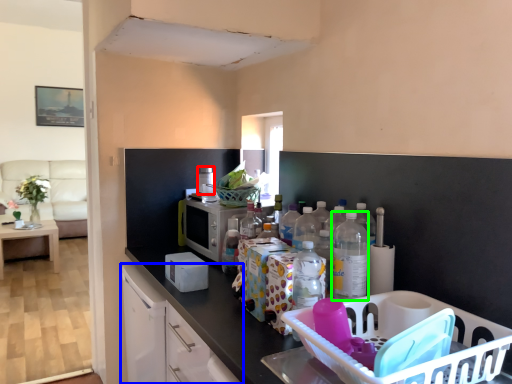
Question: Estimate the real-world distances between objects in this image. Which object is closer to appliance (highlighted by a red box), cabinetry (highlighted by a blue box) or bottle (highlighted by a green box)?

Choices:
 (A) cabinetry
 (B) bottle

Answer: (A)